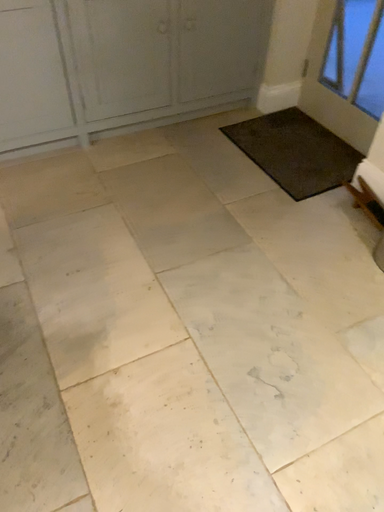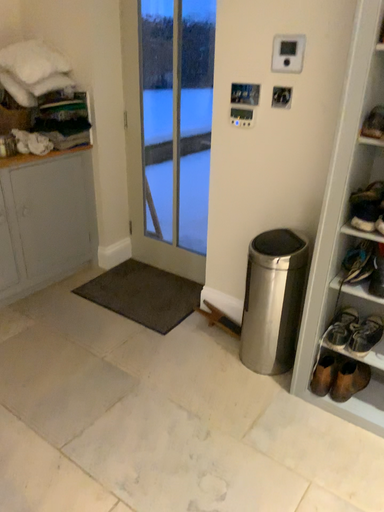
Question: How did the camera likely rotate when shooting the video?

Choices:
 (A) rotated downward
 (B) rotated upward

Answer: (B)